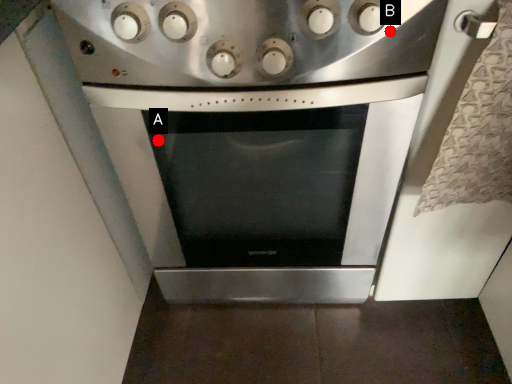
Question: Two points are circled on the image, labeled by A and B beside each circle. Which point is farther to the camera?

Choices:
 (A) A is further
 (B) B is further

Answer: (A)